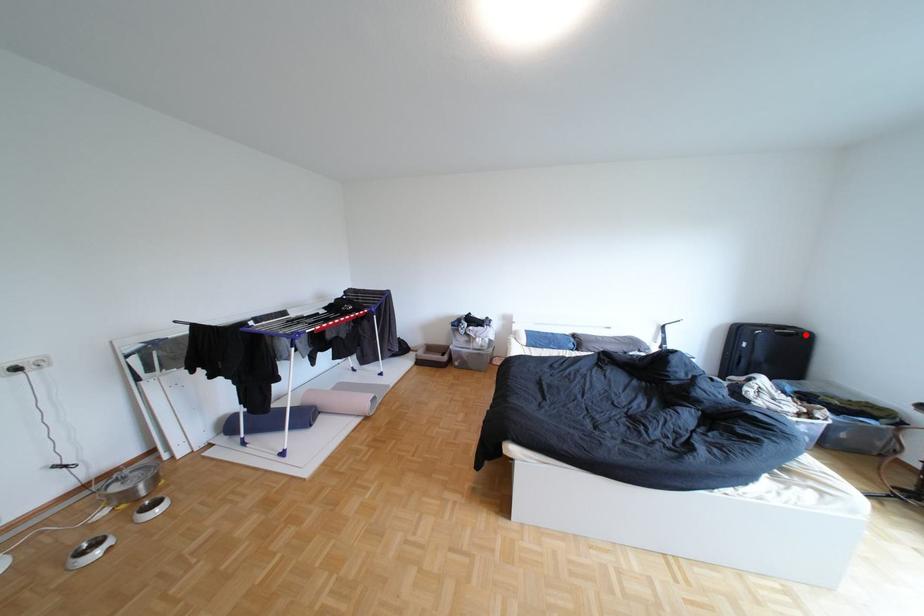
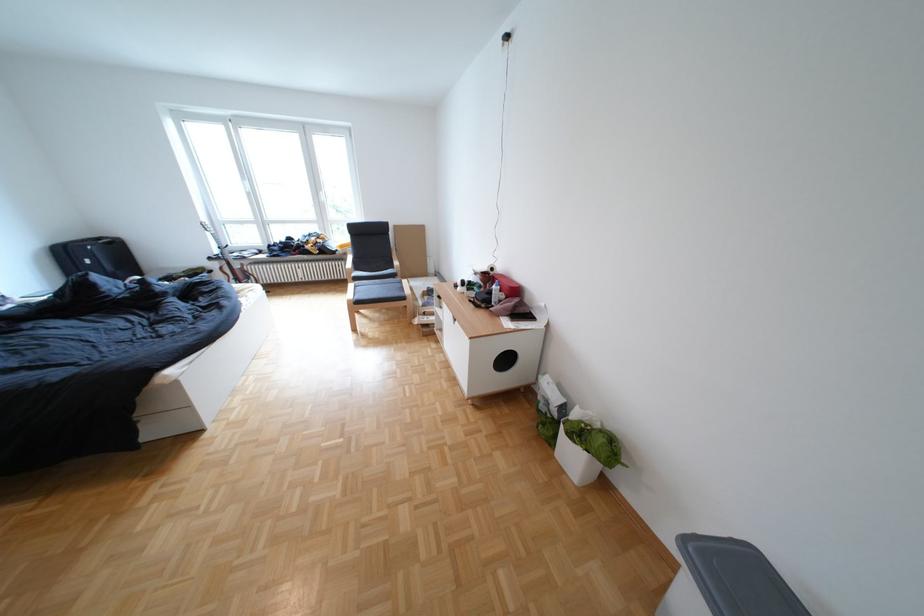
In the second image, find the point that corresponds to the highlighted location in the first image.

(126, 244)